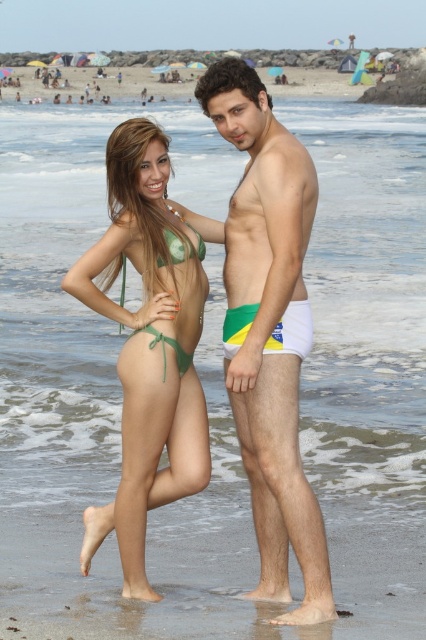
Question: Which point is closer to the camera?

Choices:
 (A) click(x=227, y=353)
 (B) click(x=123, y=253)

Answer: (A)

Question: Where is green matte bikini bottom at center located in relation to white fabric shorts at right in the image?

Choices:
 (A) left
 (B) right

Answer: (A)

Question: Among these points, which one is farthest from the camera?

Choices:
 (A) (115, 205)
 (B) (164, 228)
 (C) (250, 321)

Answer: (A)

Question: Which object is farther from the camera taking this photo?

Choices:
 (A) white fabric shorts at right
 (B) green fabric bikini at center

Answer: (A)

Question: Is green matte bikini bottom at center thinner than green fabric bikini at center?

Choices:
 (A) yes
 (B) no

Answer: (B)

Question: Is white fabric shorts at right wider than green fabric bikini at center?

Choices:
 (A) yes
 (B) no

Answer: (A)